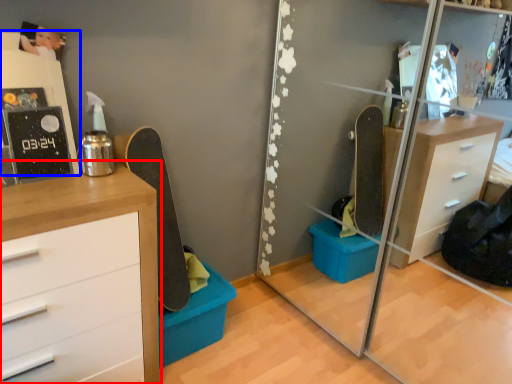
Question: Which object appears farthest to the camera in this image, chest of drawers (highlighted by a red box) or shelf (highlighted by a blue box)?

Choices:
 (A) chest of drawers
 (B) shelf

Answer: (B)